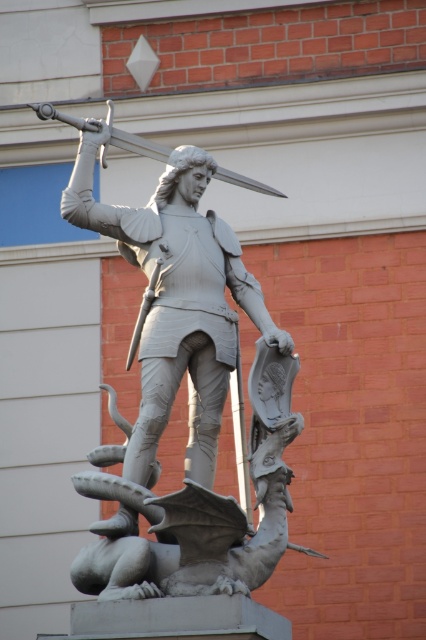
Between gray stone statue at center and polished silver sword at upper center, which one has less height?

polished silver sword at upper center

Between gray stone statue at center and polished silver sword at upper center, which one is positioned higher?

polished silver sword at upper center

Between point (267, 403) and point (83, 125), which one is positioned behind?

Point (83, 125)

Where is `gray stone statue at center`? The width and height of the screenshot is (426, 640). gray stone statue at center is located at coordinates (189, 390).